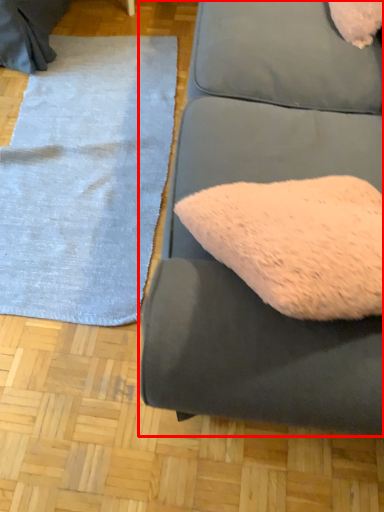
Question: From the image's perspective, what is the correct spatial positioning of studio couch (annotated by the red box) in reference to mat?

Choices:
 (A) above
 (B) below

Answer: (B)